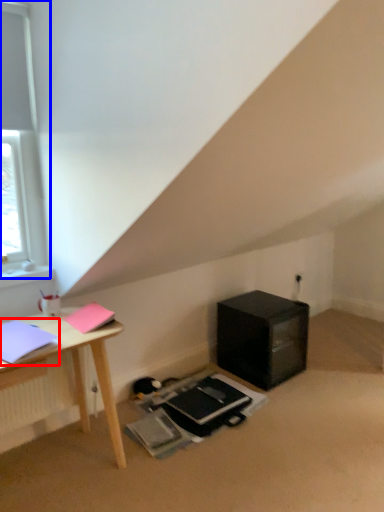
Question: Among these objects, which one is nearest to the camera, notebook (highlighted by a red box) or window (highlighted by a blue box)?

Choices:
 (A) notebook
 (B) window

Answer: (A)